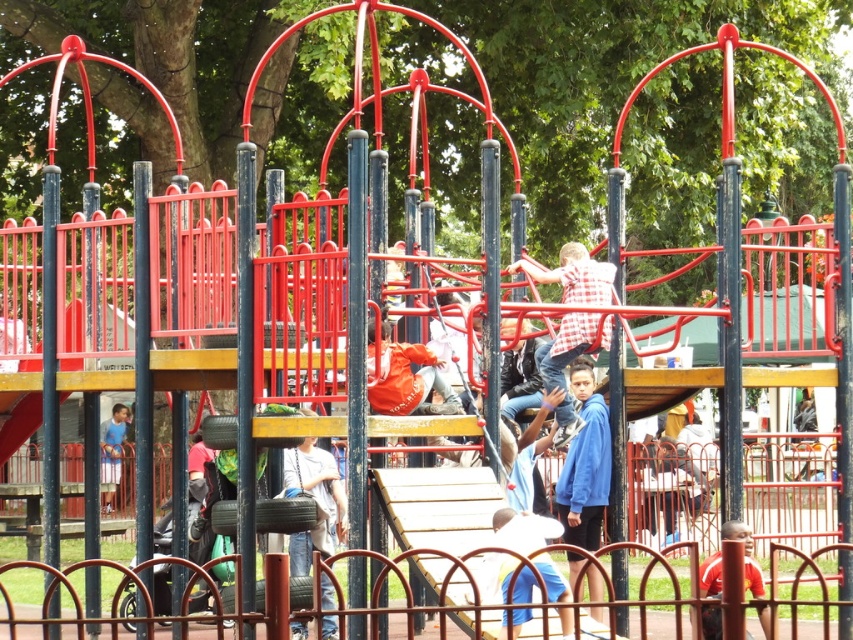
You are a parent trying to locate your children in the playground. You see the blue fleece jacket at lower right and the white cotton shirt at center. Which child is taller?

The blue fleece jacket at lower right is taller than the white cotton shirt at center, so the child in the blue fleece jacket at lower right is taller.